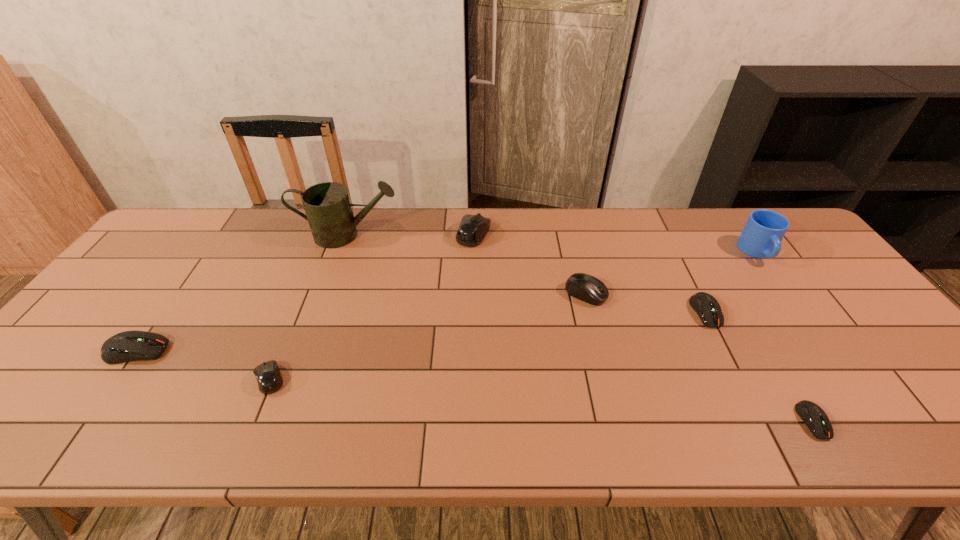
Image resolution: width=960 pixels, height=540 pixels. What are the coordinates of `vacant space at the far edge of the desktop` in the screenshot? It's located at (547, 232).

In the image, there is a desktop. At what (x,y) coordinates should I click in order to perform the action: click on vacant space at the near edge. Please return your answer as a coordinate pair (x, y). Looking at the image, I should click on (111, 418).

The width and height of the screenshot is (960, 540). I want to click on vacant area at the right edge of the desktop, so click(898, 353).

You are a GUI agent. You are given a task and a screenshot of the screen. Output one action in this format:
    pyautogui.click(x=<x>, y=<y>)
    Task: Click on the free space at the far left corner of the desktop
    This screenshot has width=960, height=540.
    Given the screenshot: What is the action you would take?
    pyautogui.click(x=220, y=213)

The width and height of the screenshot is (960, 540). In the image, there is a desktop. What are the coordinates of `free region at the near left corner` in the screenshot? It's located at (61, 413).

In the image, there is a desktop. Where is `free space at the near right corner`? free space at the near right corner is located at coordinates (937, 440).

Locate an element on the screen. This screenshot has height=540, width=960. vacant area that lies between the second dark computer equipment from left to right and the second biggest black mouse is located at coordinates (646, 303).

Find the location of a particular element. free space between the second smallest dark computer equipment and the farthest black mouse is located at coordinates (589, 273).

Where is `free area in between the shortest computer equipment and the farthest computer equipment`? The image size is (960, 540). free area in between the shortest computer equipment and the farthest computer equipment is located at coordinates (643, 327).

You are a GUI agent. You are given a task and a screenshot of the screen. Output one action in this format:
    pyautogui.click(x=<x>, y=<y>)
    Task: Click on the blank region between the watering can and the seventh shortest object
    The width and height of the screenshot is (960, 540).
    Given the screenshot: What is the action you would take?
    pyautogui.click(x=553, y=244)